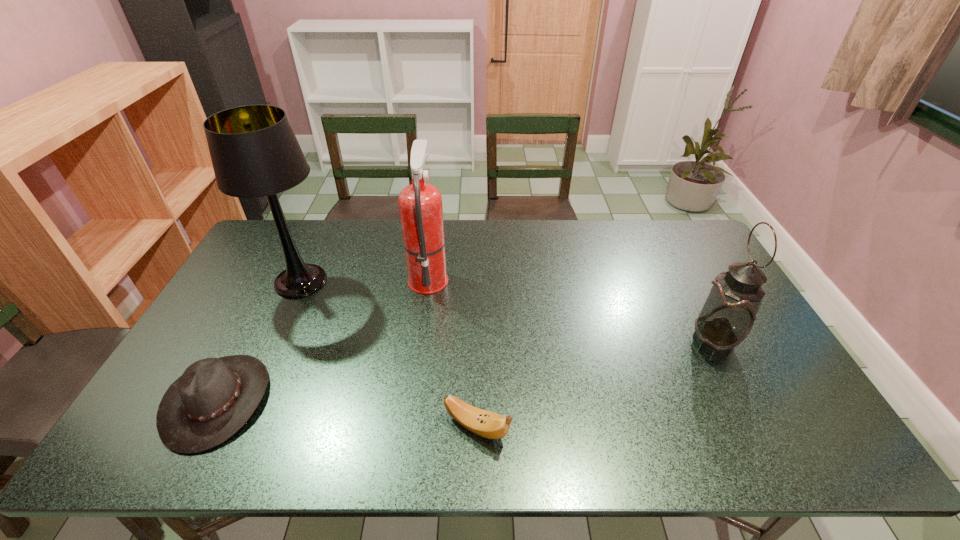
Locate an element on the screen. the tallest object is located at coordinates (254, 151).

This screenshot has width=960, height=540. What are the coordinates of `the third object from right to left` in the screenshot? It's located at (420, 204).

Find the location of `oil lamp`. oil lamp is located at coordinates (728, 314).

You are a GUI agent. You are given a task and a screenshot of the screen. Output one action in this format:
    pyautogui.click(x=<x>, y=<y>)
    Task: Click on the banana
    
    Given the screenshot: What is the action you would take?
    pyautogui.click(x=484, y=423)

Locate an element on the screen. The image size is (960, 540). hat is located at coordinates (214, 398).

Locate an element on the screen. This screenshot has width=960, height=540. free location located on the right of the tallest object is located at coordinates (386, 281).

Find the location of a particular element. The height and width of the screenshot is (540, 960). vacant space located with the handle and hose on the third object from right to left is located at coordinates (482, 277).

What are the coordinates of `vacant space situated 0.210m on the back of the rightmost object` in the screenshot? It's located at (680, 277).

Locate an element on the screen. This screenshot has height=540, width=960. vacant space located 0.180m on the left of the banana is located at coordinates (368, 427).

I want to click on vacant space located on the front-facing side of the hat, so click(x=402, y=400).